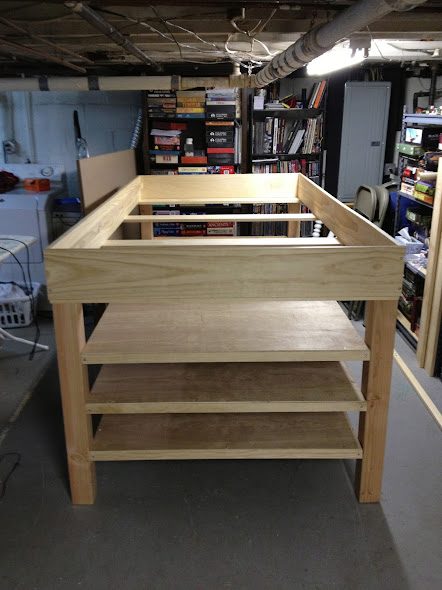
The height and width of the screenshot is (590, 442). What are the coordinates of `floor` in the screenshot? It's located at (409, 430).